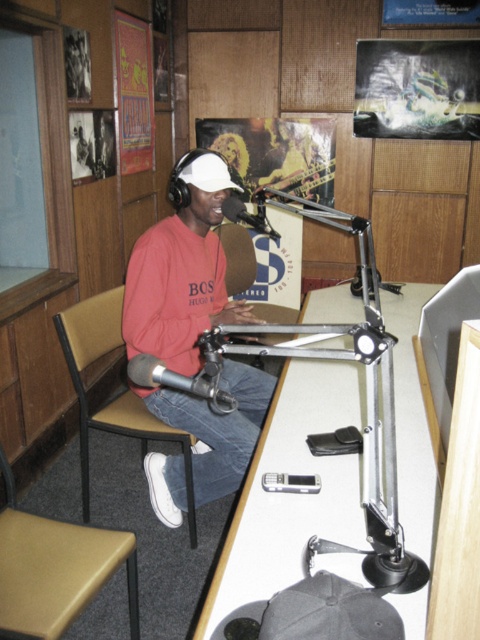
You are a person who wants to hang a picture frame on the wall behind the matte red sweatshirt at center and the brown fabric chair at left. Which object should you move first to have enough space to work?

The matte red sweatshirt at center is much taller than the brown fabric chair at left, so you should move the matte red sweatshirt at center first to create enough space for hanging the picture frame.

You are designing a layout for a small studio and need to place the tan leather chair at lower left and the silver metallic microphone at center. Given that the space is limited, which object requires more horizontal space?

The tan leather chair at lower left requires more horizontal space because its width is larger than the silver metallic microphone at center.